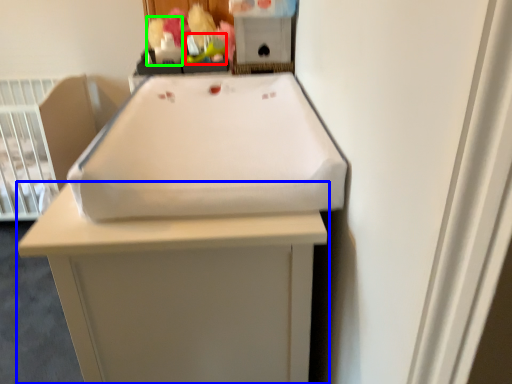
Question: Which object is positioned closest to toy (highlighted by a red box)? Select from furniture (highlighted by a blue box) and toy (highlighted by a green box).

Choices:
 (A) furniture
 (B) toy

Answer: (B)